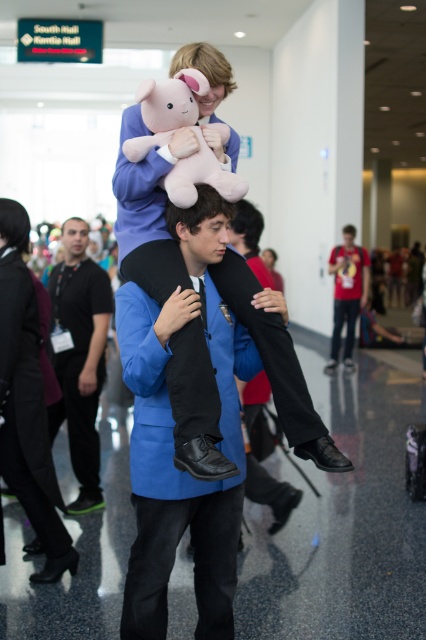
You are standing in the convention center and notice a person wearing a black matte shirt at center and denim pants at center. Which piece of clothing is nearer to you?

The black matte shirt at center is closer to the viewer than the denim pants at center.

You are standing in the convention center and see two points marked in the image. Which point, point (78, 348) or point (350, 340), is nearer to you?

Point (78, 348) is closer to the camera than point (350, 340), so it is nearer to you.

You are standing in the convention center and see the black matte shirt at center and the denim pants at center. Which one is positioned more to the left?

The black matte shirt at center is positioned to the left of the denim pants at center, so the black matte shirt at center is more to the left.